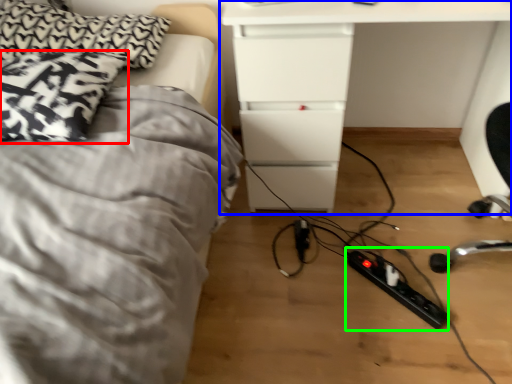
Question: Based on their relative distances, which object is farther from pillow (highlighted by a red box)? Choose from table (highlighted by a blue box) and extension cord (highlighted by a green box).

Choices:
 (A) table
 (B) extension cord

Answer: (B)